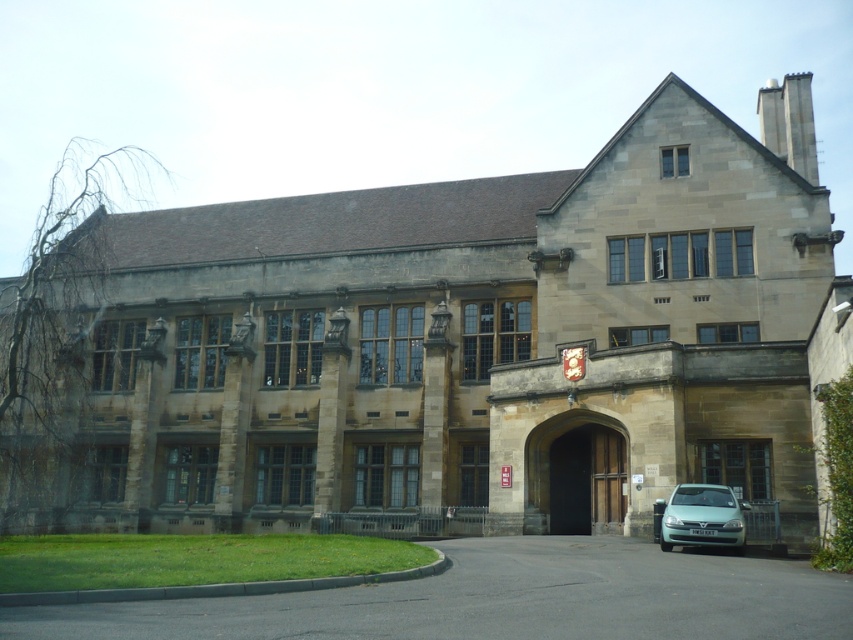
Who is higher up, black asphalt driveway at lower center or brown wooden door at center?

black asphalt driveway at lower center is higher up.

The image size is (853, 640). What do you see at coordinates (502, 600) in the screenshot?
I see `black asphalt driveway at lower center` at bounding box center [502, 600].

Who is more distant from viewer, (671, 554) or (596, 492)?

The point (596, 492) is behind.

This screenshot has height=640, width=853. Find the location of `black asphalt driveway at lower center`. black asphalt driveway at lower center is located at coordinates (502, 600).

Between black asphalt driveway at lower center and light blue metallic hatchback at lower right, which one appears on the left side from the viewer's perspective?

From the viewer's perspective, black asphalt driveway at lower center appears more on the left side.

Who is more distant from viewer, (x=9, y=630) or (x=712, y=518)?

The point (x=712, y=518) is behind.

The height and width of the screenshot is (640, 853). In order to click on black asphalt driveway at lower center in this screenshot , I will do `click(502, 600)`.

Does brown wooden door at center come behind light blue metallic hatchback at lower right?

Yes, it is.

Which of these two, brown wooden door at center or light blue metallic hatchback at lower right, stands shorter?

Standing shorter between the two is light blue metallic hatchback at lower right.

Which is behind, point (560, 500) or point (665, 545)?

The point (560, 500) is more distant.

In order to click on brown wooden door at center in this screenshot , I will do `click(576, 474)`.